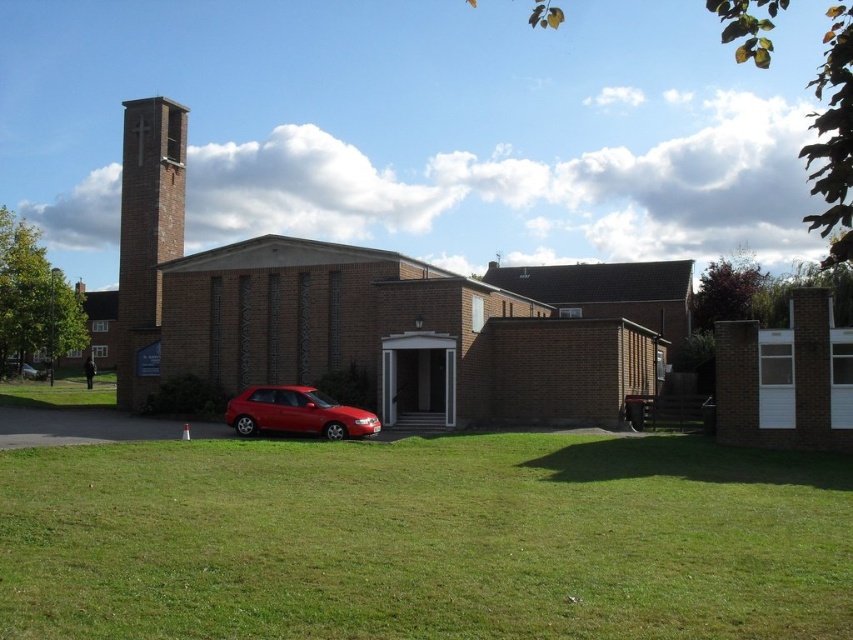
You are a visitor arriving at the church and see the brick church at center and the shiny red hatchback at lower left. Which object is closer to the entrance of the church?

The shiny red hatchback at lower left is closer to the entrance of the church because the brick church at center is positioned on the right side of the shiny red hatchback at lower left, implying the hatchback is nearer to the entrance.

You are a visitor arriving at the church and notice the shiny red hatchback at lower left and the brick bell tower at left. From your vantage point, which vehicle is closer to you?

The shiny red hatchback at lower left is behind the brick bell tower at left, so the brick bell tower at left is closer to you.